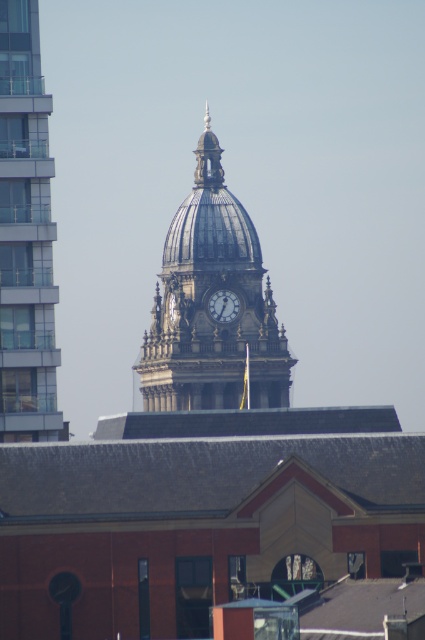
You are standing at the point labeled as point (207, 301) in the image. Which object are you facing directly?

The point labeled as point (207, 301) corresponds to the shiny metallic clock tower at center, so you are facing the shiny metallic clock tower at center directly.

You are an architect evaluating the design of the clock tower and the modern building. Which object, the shiny metallic clock tower at center or the matte white clock at center, has a larger size in the image?

The shiny metallic clock tower at center is bigger than the matte white clock at center, so the shiny metallic clock tower at center has a larger size in the image.